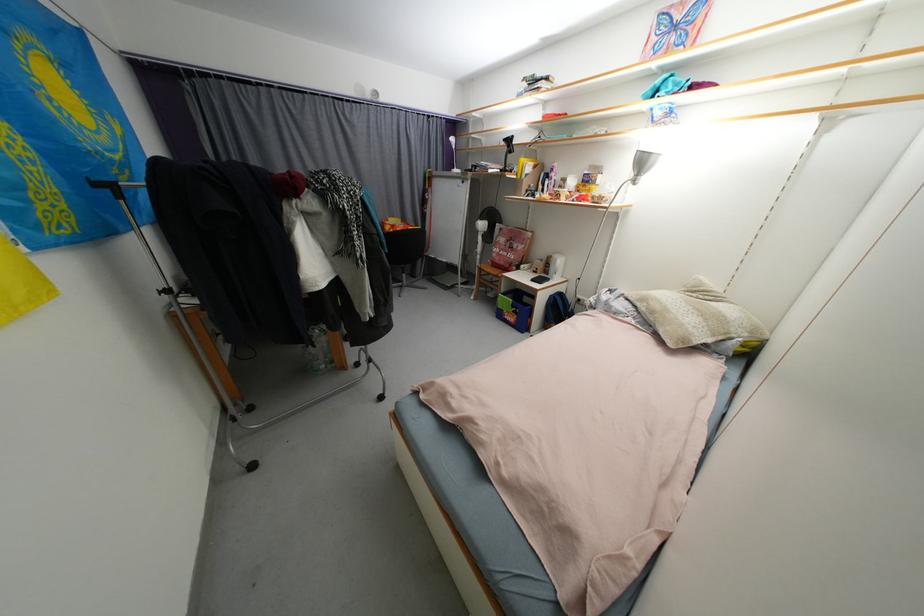
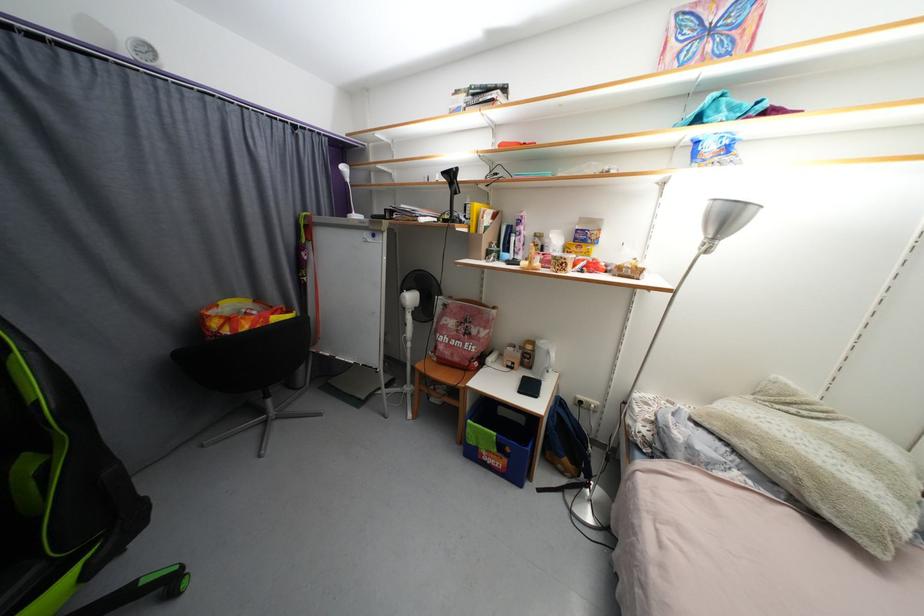
In the second image, find the point that corresponds to [557,257] in the first image.

(538, 344)